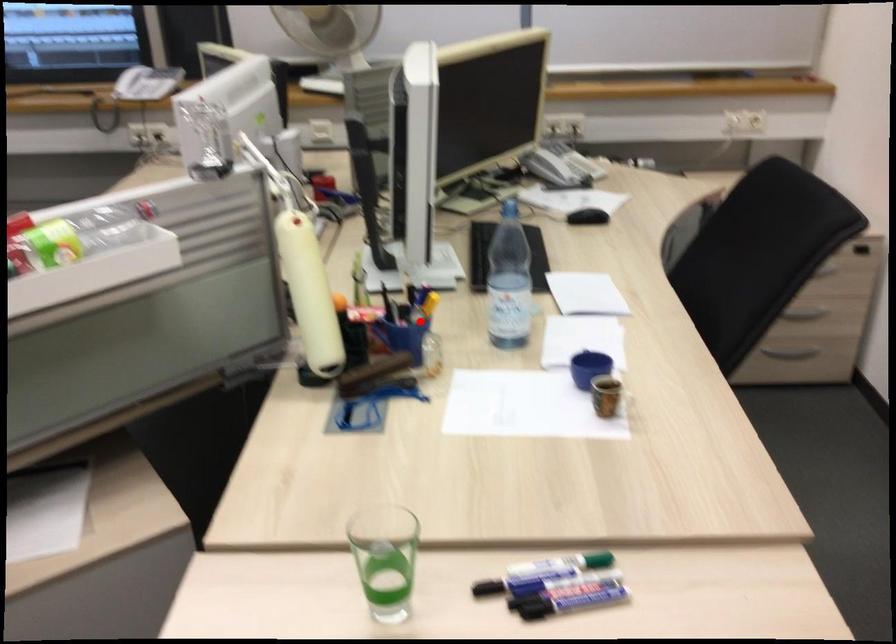
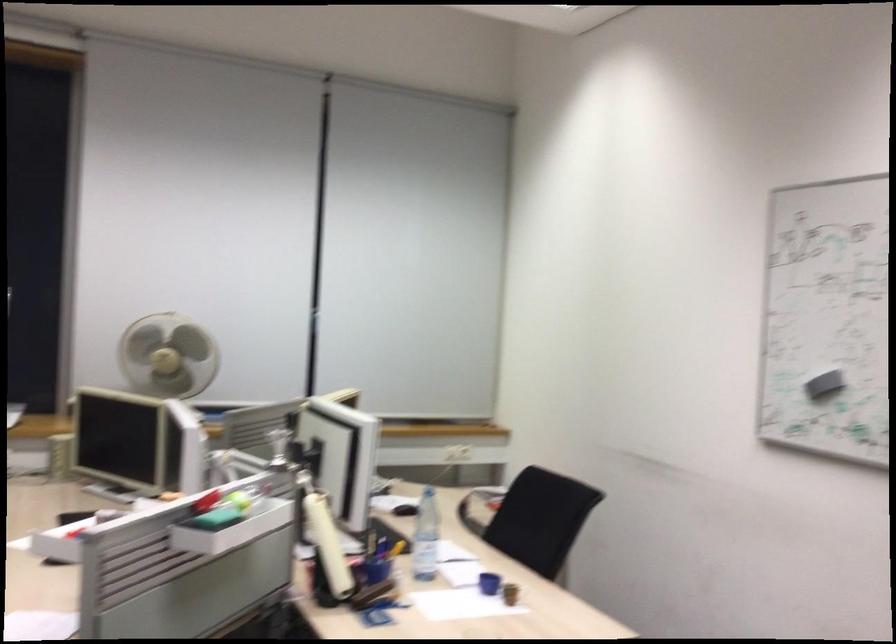
Question: I am providing you with two images of the same scene from different viewpoints. Image1 has a red point marked. In image2, the corresponding 3D location appears at what relative position? Reply with the corresponding letter.

Choices:
 (A) Closer
 (B) Farther

Answer: (B)